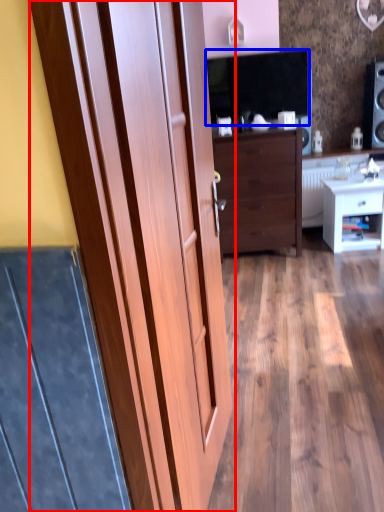
Question: Among these objects, which one is farthest to the camera, door (highlighted by a red box) or dark (highlighted by a blue box)?

Choices:
 (A) door
 (B) dark

Answer: (B)